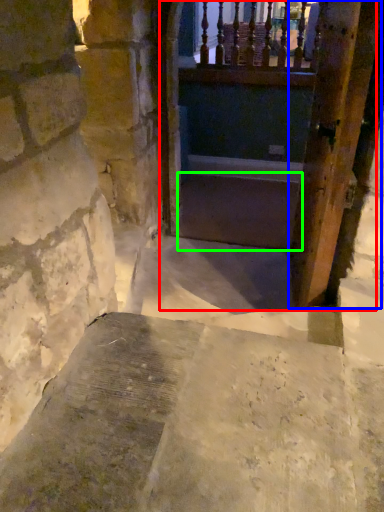
Question: Which object is positioned farthest from tunnel (highlighted by a red box)? Select from door (highlighted by a blue box) and stairs (highlighted by a green box).

Choices:
 (A) door
 (B) stairs

Answer: (A)